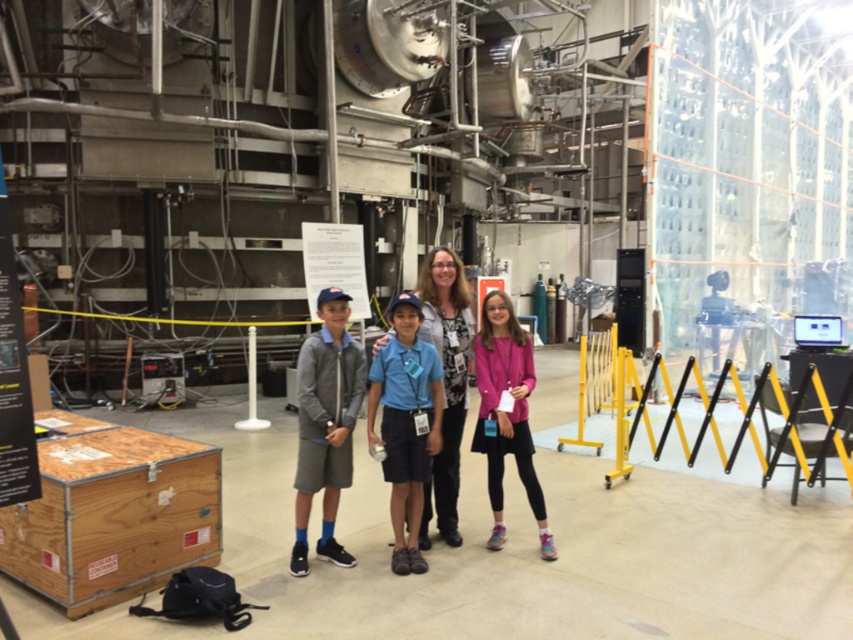
Question: Which object is positioned closest to the matte gray sweater at center?

Choices:
 (A) gray cotton shorts at center
 (B) pink fabric jacket at center

Answer: (B)

Question: Considering the relative positions of pink fabric jacket at center and matte gray sweater at center in the image provided, where is pink fabric jacket at center located with respect to matte gray sweater at center?

Choices:
 (A) below
 (B) above

Answer: (A)

Question: Which object is the farthest from the pink fabric jacket at center?

Choices:
 (A) matte gray sweater at center
 (B) gray cotton shorts at center

Answer: (B)

Question: Estimate the real-world distances between objects in this image. Which object is farther from the pink fabric jacket at center?

Choices:
 (A) matte gray sweater at center
 (B) gray cotton shorts at center

Answer: (B)

Question: Can you confirm if gray cotton shorts at center is bigger than pink fabric jacket at center?

Choices:
 (A) no
 (B) yes

Answer: (A)

Question: Is gray cotton shorts at center further to the viewer compared to matte gray sweater at center?

Choices:
 (A) no
 (B) yes

Answer: (A)